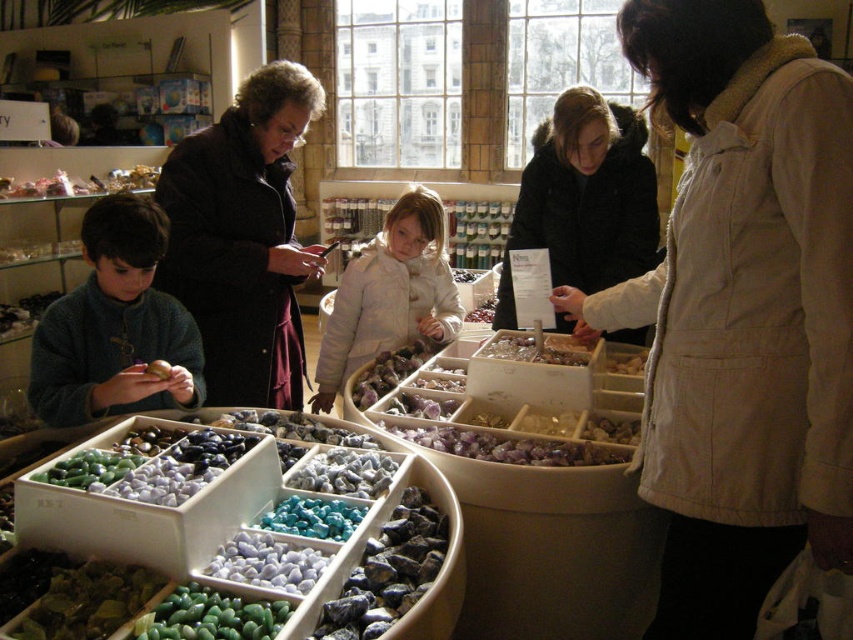
Between beige cotton vest at center and dark blue sweater at left, which one is positioned lower?

beige cotton vest at center

Describe the element at coordinates (741, 312) in the screenshot. I see `beige cotton vest at center` at that location.

Is point (819, 419) positioned after point (149, 385)?

No.

Where is `beige cotton vest at center`? Image resolution: width=853 pixels, height=640 pixels. beige cotton vest at center is located at coordinates (741, 312).

Can you confirm if smooth polished stones at center is thinner than black fur-trimmed coat at center?

In fact, smooth polished stones at center might be wider than black fur-trimmed coat at center.

In order to click on smooth polished stones at center in this screenshot , I will do `click(236, 541)`.

Can you confirm if dark brown coat at center is thinner than dark blue sweater at left?

Incorrect, dark brown coat at center's width is not less than dark blue sweater at left's.

Can you confirm if dark brown coat at center is taller than dark blue sweater at left?

Yes.

At what (x,y) coordinates should I click in order to perform the action: click on dark brown coat at center. Please return your answer as a coordinate pair (x, y). This screenshot has height=640, width=853. Looking at the image, I should click on (242, 237).